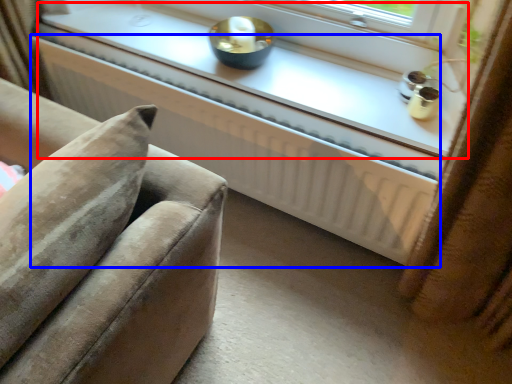
Question: Among these objects, which one is nearest to the camera, window sill (highlighted by a red box) or radiator (highlighted by a blue box)?

Choices:
 (A) window sill
 (B) radiator

Answer: (B)